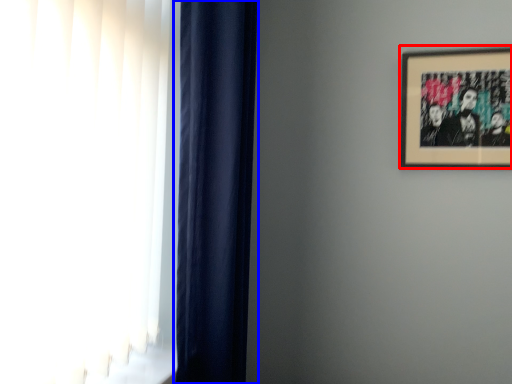
Question: Which of the following is the closest to the observer, picture frame (highlighted by a red box) or curtain (highlighted by a blue box)?

Choices:
 (A) picture frame
 (B) curtain

Answer: (B)